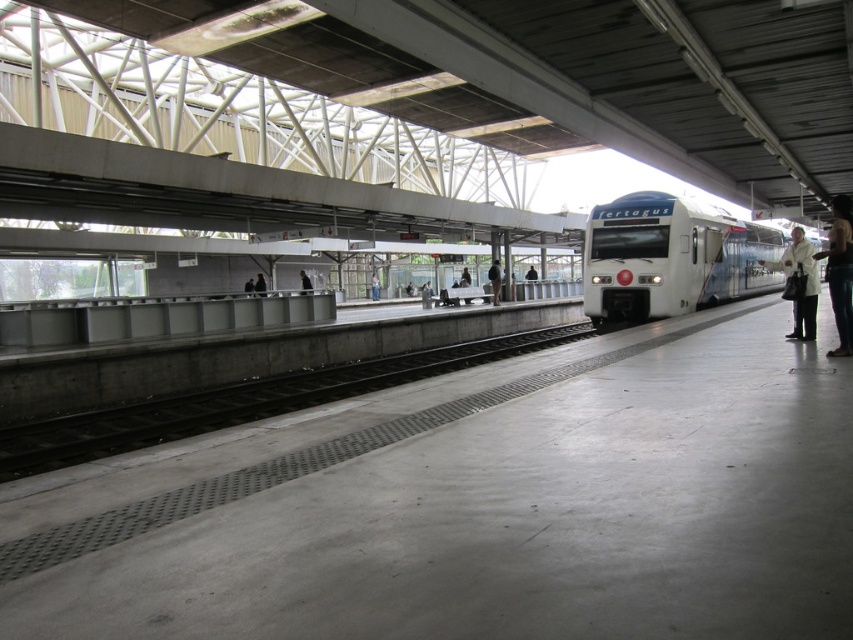
Question: Does concrete at center appear on the right side of light blue jeans at center?

Choices:
 (A) yes
 (B) no

Answer: (A)

Question: Which point is farther to the camera?

Choices:
 (A) white coat at right
 (B) matte black jacket at center
 (C) white glossy train at center

Answer: (B)

Question: Can you confirm if black leather pants at right is thinner than white coat at right?

Choices:
 (A) yes
 (B) no

Answer: (B)

Question: Among these points, which one is farthest from the camera?

Choices:
 (A) click(x=192, y=417)
 (B) click(x=492, y=298)

Answer: (B)

Question: Is matte black jacket at center thinner than black leather jacket at center?

Choices:
 (A) yes
 (B) no

Answer: (A)

Question: Which object appears farthest from the camera in this image?

Choices:
 (A) white glossy train at center
 (B) black fabric person at center

Answer: (B)